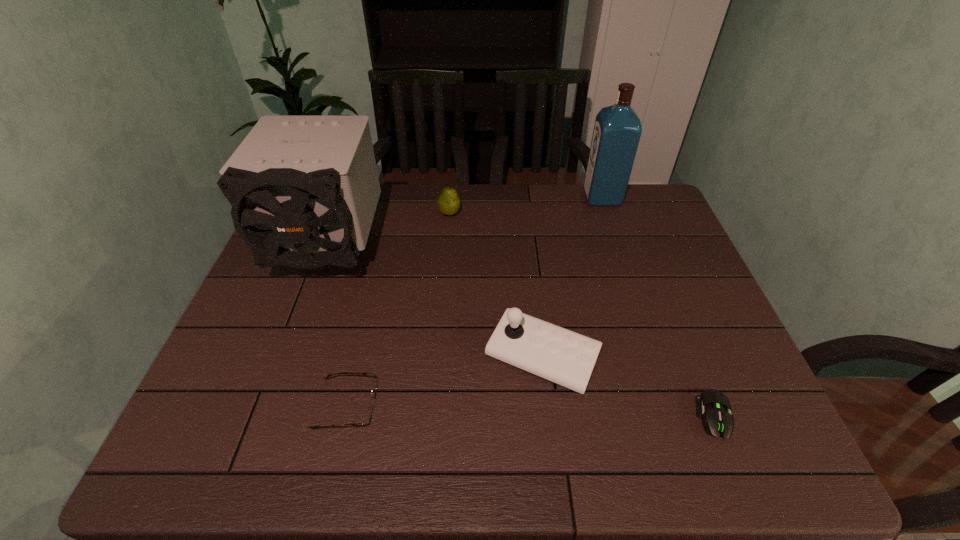
Locate an element on the screen. The width and height of the screenshot is (960, 540). free space located 0.100m on the back of the fan is located at coordinates (349, 199).

Locate an element on the screen. The height and width of the screenshot is (540, 960). free space located 0.200m on the left of the joystick is located at coordinates (401, 356).

Identify the location of blank space located 0.160m on the front of the pear. Image resolution: width=960 pixels, height=540 pixels. (446, 253).

Where is `free location located 0.120m on the front-facing side of the fifth tallest object`? Image resolution: width=960 pixels, height=540 pixels. free location located 0.120m on the front-facing side of the fifth tallest object is located at coordinates (431, 407).

This screenshot has height=540, width=960. Identify the location of free region located on the left of the shortest object. (668, 416).

The width and height of the screenshot is (960, 540). Find the location of `liquor present at the far edge`. liquor present at the far edge is located at coordinates (617, 130).

I want to click on fan positioned at the far edge, so click(304, 189).

The width and height of the screenshot is (960, 540). In order to click on pear that is at the far edge in this screenshot , I will do `click(448, 203)`.

The image size is (960, 540). Identify the location of spectacles present at the near edge. (367, 420).

Image resolution: width=960 pixels, height=540 pixels. Identify the location of computer mouse at the near edge. (717, 417).